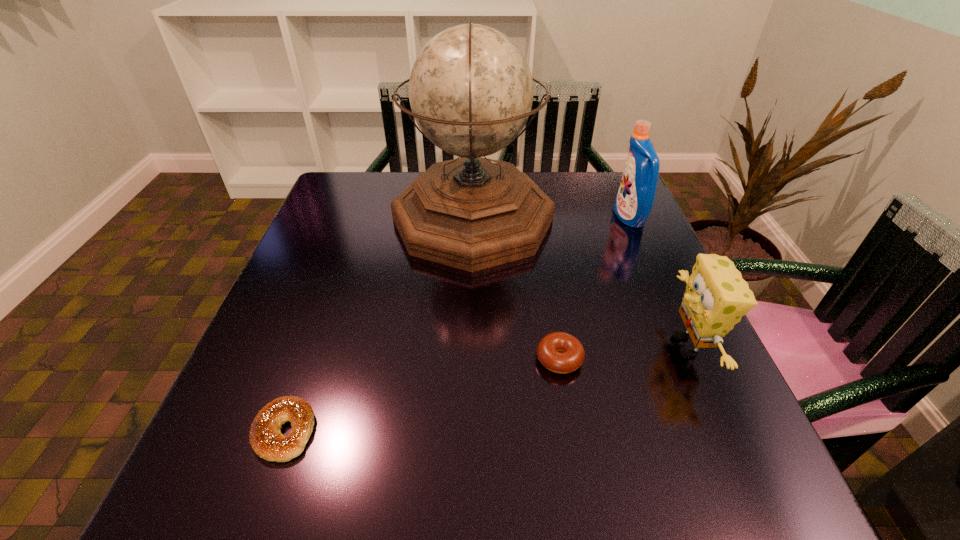
The width and height of the screenshot is (960, 540). What are the coordinates of `sponge at the right edge` in the screenshot? It's located at (716, 297).

Find the location of a particular element. The image size is (960, 540). object located at the near left corner is located at coordinates (267, 441).

This screenshot has height=540, width=960. Identify the location of object that is at the far right corner. (635, 198).

At what (x,y) coordinates should I click in order to perform the action: click on free space at the near edge of the desktop. Please return your answer as a coordinate pair (x, y). This screenshot has width=960, height=540. Looking at the image, I should click on (489, 496).

You are a GUI agent. You are given a task and a screenshot of the screen. Output one action in this format:
    pyautogui.click(x=<x>, y=<y>)
    Task: Click on the free space at the left edge
    
    Given the screenshot: What is the action you would take?
    pyautogui.click(x=273, y=369)

Locate an element on the screen. The width and height of the screenshot is (960, 540). free space at the right edge is located at coordinates (632, 227).

Locate an element on the screen. free spot at the far left corner of the desktop is located at coordinates (358, 208).

In the image, there is a desktop. At what (x,y) coordinates should I click in order to perform the action: click on vacant space at the far right corner. Please return your answer as a coordinate pair (x, y). The image size is (960, 540). Looking at the image, I should click on (574, 177).

What are the coordinates of `vacant space at the near right corner of the desktop` in the screenshot? It's located at (674, 487).

Locate an element on the screen. vacant space in between the tallest object and the third shortest object is located at coordinates (580, 282).